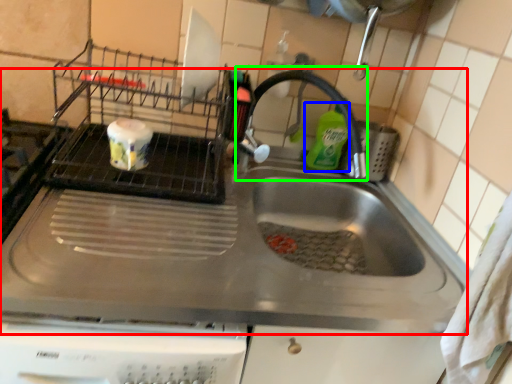
Question: Estimate the real-world distances between objects in this image. Which object is farther from sink (highlighted by a red box), cleaning product (highlighted by a blue box) or faucet (highlighted by a green box)?

Choices:
 (A) cleaning product
 (B) faucet

Answer: (A)